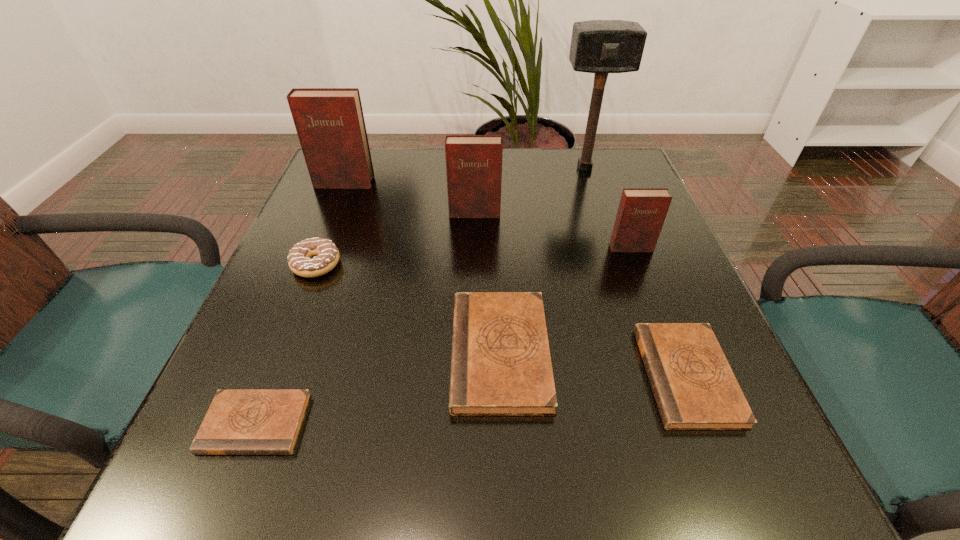
I want to click on doughnut at the left edge, so click(x=300, y=260).

This screenshot has width=960, height=540. What are the coordinates of `mallet present at the right edge` in the screenshot? It's located at (597, 46).

Identify the location of object that is at the far left corner. (330, 124).

Identify the location of object that is at the near left corner. This screenshot has height=540, width=960. (238, 422).

I want to click on object that is at the far right corner, so click(x=597, y=46).

In the image, there is a desktop. Where is `free space at the far edge`? This screenshot has height=540, width=960. free space at the far edge is located at coordinates (515, 160).

In the image, there is a desktop. Where is `free space at the near edge`? The height and width of the screenshot is (540, 960). free space at the near edge is located at coordinates (338, 452).

The width and height of the screenshot is (960, 540). In the image, there is a desktop. Find the location of `free space at the left edge`. free space at the left edge is located at coordinates (345, 198).

At what (x,y) coordinates should I click in order to perform the action: click on vacant space at the far left corner. Please return your answer as a coordinate pair (x, y). This screenshot has height=540, width=960. Looking at the image, I should click on (368, 192).

Locate an element on the screen. vacant space at the near left corner is located at coordinates (215, 456).